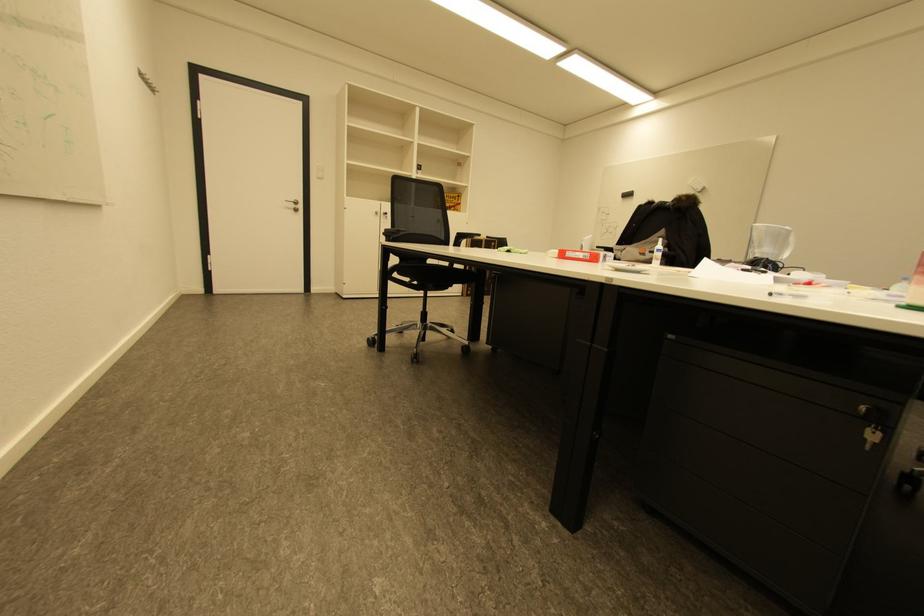
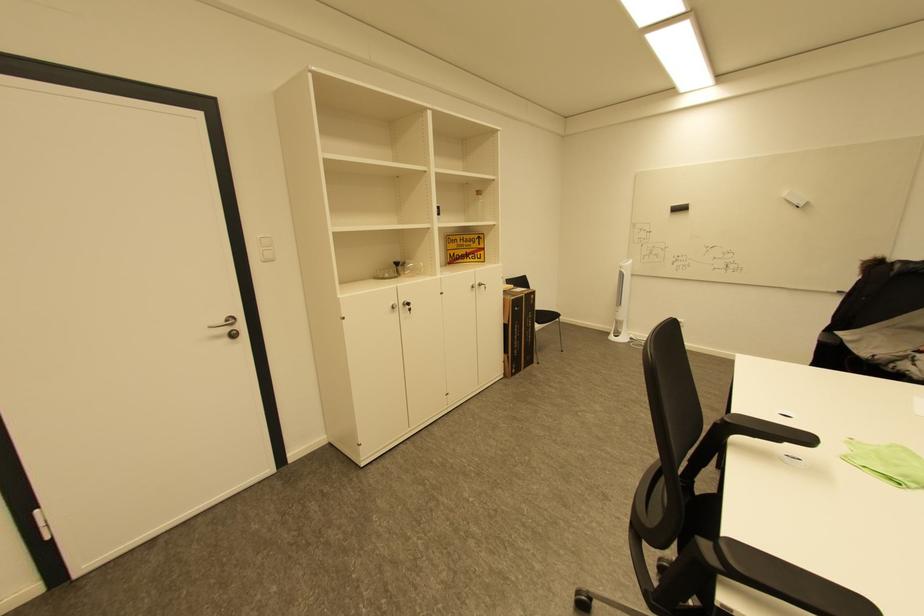
The point at (299,207) is marked in the first image. Where is the corresponding point in the second image?

(233, 330)